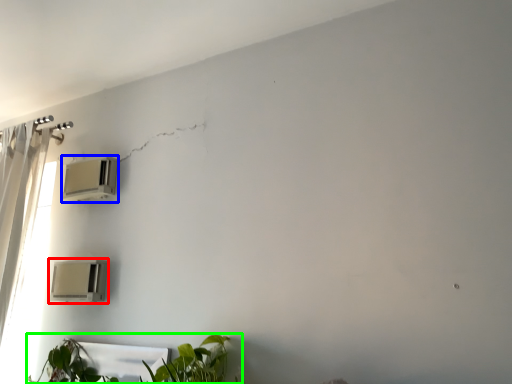
Question: Which is farther away from air conditioning (highlighted by a red box)? air conditioning (highlighted by a blue box) or houseplant (highlighted by a green box)?

Choices:
 (A) air conditioning
 (B) houseplant

Answer: (A)